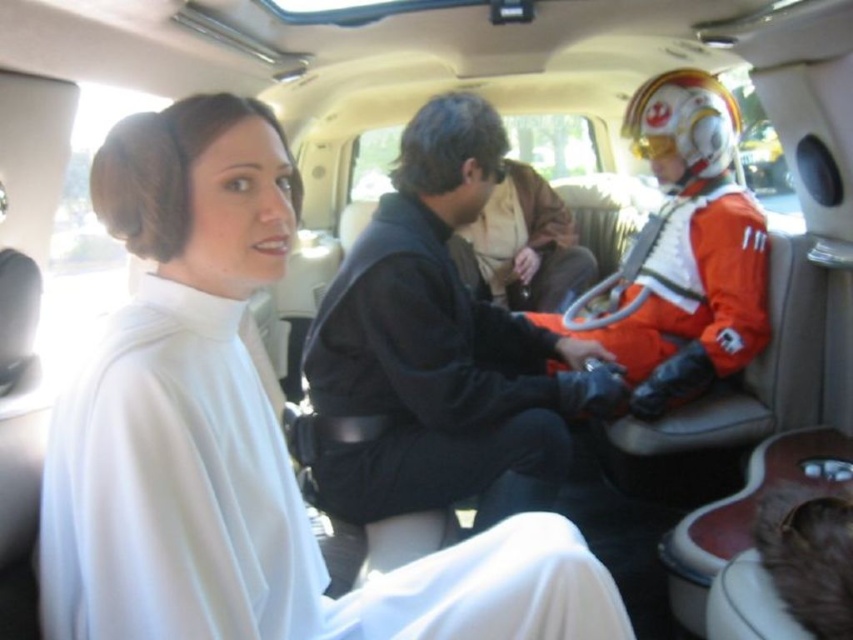
Question: Which of the following is the farthest from the observer?

Choices:
 (A) (390, 275)
 (B) (628, 298)

Answer: (B)

Question: Is white satin dress at left further to the viewer compared to black leather jacket at center?

Choices:
 (A) no
 (B) yes

Answer: (A)

Question: Which point is farther from the camera taking this photo?

Choices:
 (A) (747, 227)
 (B) (372, 288)

Answer: (A)

Question: Which point is closer to the camera?

Choices:
 (A) (166, 132)
 (B) (666, 243)

Answer: (A)

Question: Is white satin dress at left to the right of black leather jacket at center from the viewer's perspective?

Choices:
 (A) no
 (B) yes

Answer: (A)

Question: Can you confirm if white satin dress at left is bigger than black leather jacket at center?

Choices:
 (A) no
 (B) yes

Answer: (A)